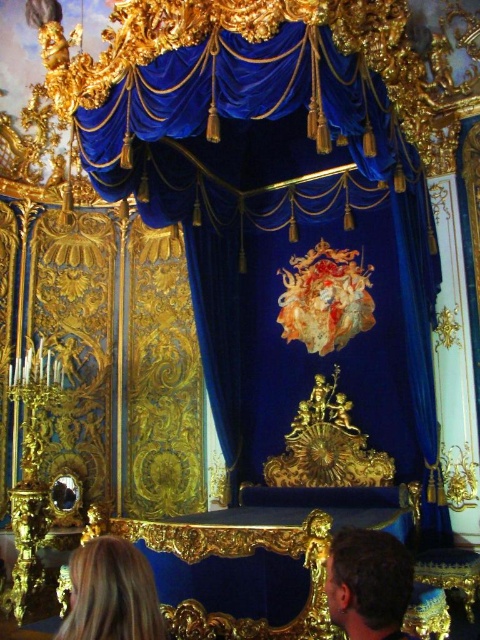
Question: Is blonde hair at lower left thinner than brown hair at lower right?

Choices:
 (A) yes
 (B) no

Answer: (B)

Question: Among these points, which one is nearest to the camera?

Choices:
 (A) (328, 598)
 (B) (99, 563)

Answer: (B)

Question: Which point appears closest to the camera in this image?

Choices:
 (A) 106,580
 (B) 343,531

Answer: (A)

Question: Is blonde hair at lower left below brown hair at lower right?

Choices:
 (A) no
 (B) yes

Answer: (B)

Question: Does blonde hair at lower left come behind brown hair at lower right?

Choices:
 (A) no
 (B) yes

Answer: (A)